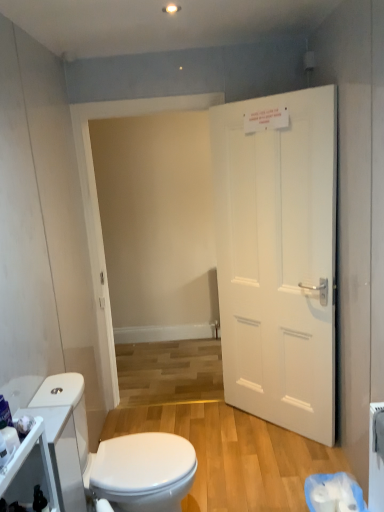
You are a GUI agent. You are given a task and a screenshot of the screen. Output one action in this format:
    pyautogui.click(x=<x>, y=<y>)
    Task: Click on the free space in front of white matte door at right
    This screenshot has height=512, width=384.
    Given the screenshot: What is the action you would take?
    pyautogui.click(x=269, y=465)